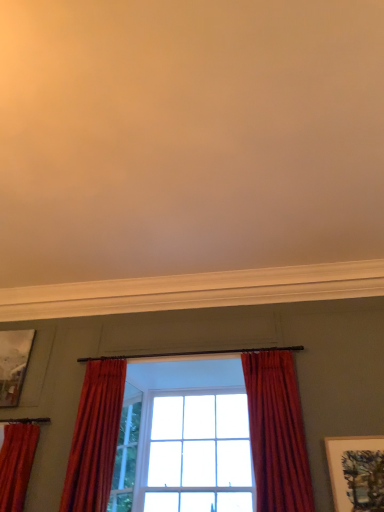
Question: Is velvet red curtain at center, arranged as the third curtain when viewed from the left, oriented towards satin red curtain at center, positioned as the second curtain in right-to-left order?

Choices:
 (A) no
 (B) yes

Answer: (A)

Question: From a real-world perspective, is velvet red curtain at center, arranged as the third curtain when viewed from the left, on top of satin red curtain at center, which is the second curtain from left to right?

Choices:
 (A) no
 (B) yes

Answer: (B)

Question: Can you confirm if velvet red curtain at center, which ranks as the 1th curtain in right-to-left order, is shorter than satin red curtain at center, which is the second curtain from left to right?

Choices:
 (A) no
 (B) yes

Answer: (A)

Question: Is the depth of velvet red curtain at center, arranged as the third curtain when viewed from the left, less than that of satin red curtain at center, positioned as the second curtain in right-to-left order?

Choices:
 (A) yes
 (B) no

Answer: (A)

Question: From a real-world perspective, does velvet red curtain at center, arranged as the third curtain when viewed from the left, sit lower than satin red curtain at center, positioned as the second curtain in right-to-left order?

Choices:
 (A) no
 (B) yes

Answer: (A)

Question: Considering the positions of matte white picture frame at lower right, which is the 2th picture frame from top to bottom, and satin red curtain at center, which is the second curtain from left to right, in the image, is matte white picture frame at lower right, which is the 2th picture frame from top to bottom, wider or thinner than satin red curtain at center, which is the second curtain from left to right,?

Choices:
 (A) wide
 (B) thin

Answer: (B)

Question: Would you say matte white picture frame at lower right, acting as the 1th picture frame starting from the right, is to the left or to the right of satin red curtain at center, which is the second curtain from left to right, in the picture?

Choices:
 (A) left
 (B) right

Answer: (B)

Question: Based on their sizes in the image, would you say matte white picture frame at lower right, the 1th picture frame in the front-to-back sequence, is bigger or smaller than satin red curtain at center, which is the second curtain from left to right?

Choices:
 (A) big
 (B) small

Answer: (B)

Question: From a real-world perspective, is matte white picture frame at lower right, acting as the 1th picture frame starting from the right, physically located above or below satin red curtain at center, positioned as the second curtain in right-to-left order?

Choices:
 (A) above
 (B) below

Answer: (B)

Question: From a real-world perspective, relative to velvet red curtain at left, the first curtain from the left, is matte white picture frame at lower right, acting as the second picture frame starting from the back, vertically above or below?

Choices:
 (A) below
 (B) above

Answer: (A)

Question: In terms of height, does matte white picture frame at lower right, the 1th picture frame in the front-to-back sequence, look taller or shorter compared to velvet red curtain at left, placed as the 3th curtain when sorted from right to left?

Choices:
 (A) short
 (B) tall

Answer: (A)

Question: From the image's perspective, relative to velvet red curtain at left, placed as the 3th curtain when sorted from right to left, is matte white picture frame at lower right, which is the 2th picture frame from top to bottom, above or below?

Choices:
 (A) above
 (B) below

Answer: (A)

Question: In the image, is matte white picture frame at lower right, the 1th picture frame in the front-to-back sequence, on the left side or the right side of velvet red curtain at left, placed as the 3th curtain when sorted from right to left?

Choices:
 (A) left
 (B) right

Answer: (B)

Question: Is velvet red curtain at left, the first curtain from the left, in front of or behind velvet red curtain at center, which ranks as the 1th curtain in right-to-left order, in the image?

Choices:
 (A) behind
 (B) front

Answer: (A)

Question: Visually, is velvet red curtain at left, the first curtain from the left, positioned to the left or to the right of velvet red curtain at center, arranged as the third curtain when viewed from the left?

Choices:
 (A) right
 (B) left

Answer: (B)